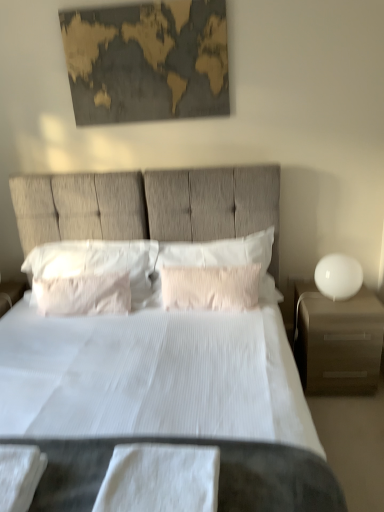
Image resolution: width=384 pixels, height=512 pixels. What do you see at coordinates (338, 276) in the screenshot?
I see `white glossy sphere at right` at bounding box center [338, 276].

Locate an element on the screen. This screenshot has height=512, width=384. white textured pillow at center, acting as the 2th pillow starting from the right is located at coordinates [210, 287].

Where is `white cotton towel at lower left, which is the first sheet from left to right`? This screenshot has height=512, width=384. white cotton towel at lower left, which is the first sheet from left to right is located at coordinates (19, 476).

I want to click on pink textured pillow at center, the 4th pillow viewed from the left, so [217, 252].

Image resolution: width=384 pixels, height=512 pixels. I want to click on white glossy sphere at right, so click(338, 276).

Based on their sizes in the image, would you say white cotton sheet at center, the 2th sheet positioned from the left, is bigger or smaller than matte brown nightstand at right?

white cotton sheet at center, the 2th sheet positioned from the left, is smaller than matte brown nightstand at right.

How different are the orientations of white cotton sheet at center, the 2th sheet positioned from the left, and matte brown nightstand at right in degrees?

white cotton sheet at center, the 2th sheet positioned from the left, and matte brown nightstand at right are facing 1.43 degrees away from each other.

Is white cotton sheet at center, the 2th sheet positioned from the left, positioned in front of matte brown nightstand at right?

Yes.

From a real-world perspective, which is physically above, white cotton sheet at center, the first sheet viewed from the right, or matte brown nightstand at right?

white cotton sheet at center, the first sheet viewed from the right, is physically above.

You are a GUI agent. You are given a task and a screenshot of the screen. Output one action in this format:
    pyautogui.click(x=<x>, y=<y>)
    Task: Click on the bed that appears on the left of white cotton sheet at center, the 2th sheet positioned from the left
    The image size is (384, 512).
    Given the screenshot: What is the action you would take?
    pyautogui.click(x=148, y=205)

Can you tell me how much white textured bed at center and white cotton sheet at center, the 2th sheet positioned from the left, differ in facing direction?

The angle between the facing direction of white textured bed at center and the facing direction of white cotton sheet at center, the 2th sheet positioned from the left, is 0.000209 degrees.

Considering the sizes of objects white textured bed at center and white cotton sheet at center, the 2th sheet positioned from the left, in the image provided, who is smaller, white textured bed at center or white cotton sheet at center, the 2th sheet positioned from the left,?

Smaller between the two is white cotton sheet at center, the 2th sheet positioned from the left.

Based on the photo, does white textured bed at center have a greater width compared to white cotton sheet at center, the first sheet viewed from the right?

Correct, the width of white textured bed at center exceeds that of white cotton sheet at center, the first sheet viewed from the right.

In the scene shown: Considering the relative sizes of white soft pillow at center, placed as the first pillow when sorted from left to right, and white soft pillow at center, marked as the 3th pillow in a right-to-left arrangement, in the image provided, is white soft pillow at center, placed as the first pillow when sorted from left to right, bigger than white soft pillow at center, marked as the 3th pillow in a right-to-left arrangement,?

Yes, white soft pillow at center, placed as the first pillow when sorted from left to right, is bigger than white soft pillow at center, marked as the 3th pillow in a right-to-left arrangement.

Is white soft pillow at center, marked as the 4th pillow in a right-to-left arrangement, placed right next to white soft pillow at center, which is the second pillow from left to right?

Yes, white soft pillow at center, marked as the 4th pillow in a right-to-left arrangement, is next to white soft pillow at center, which is the second pillow from left to right.

Consider the image. Which object is positioned more to the right, white soft pillow at center, marked as the 4th pillow in a right-to-left arrangement, or white soft pillow at center, marked as the 3th pillow in a right-to-left arrangement?

From the viewer's perspective, white soft pillow at center, marked as the 3th pillow in a right-to-left arrangement, appears more on the right side.

Considering the points (118, 285) and (70, 308), which point is in front, point (118, 285) or point (70, 308)?

Positioned in front is point (70, 308).

In the image, there is a white cotton sheet at center, the 2th sheet positioned from the left. Where is `sheet below it (from the image's perspective)`? The image size is (384, 512). sheet below it (from the image's perspective) is located at coordinates (19, 476).

Consider the image. From the image's perspective, is white cotton sheet at center, the 2th sheet positioned from the left, under white cotton towel at lower left, which is the first sheet from left to right?

Incorrect, from the image's perspective, white cotton sheet at center, the 2th sheet positioned from the left, is higher than white cotton towel at lower left, which is the first sheet from left to right.

Are white cotton sheet at center, the first sheet viewed from the right, and white cotton towel at lower left, which is the first sheet from left to right, making contact?

No, white cotton sheet at center, the first sheet viewed from the right, is not with white cotton towel at lower left, which is the first sheet from left to right.

Which object is further away from the camera taking this photo, white cotton sheet at center, the 2th sheet positioned from the left, or white cotton towel at lower left, which is the first sheet from left to right?

white cotton towel at lower left, which is the first sheet from left to right, is behind.

Is pink textured pillow at center, the 4th pillow viewed from the left, smaller than white glossy sphere at right?

Incorrect, pink textured pillow at center, the 4th pillow viewed from the left, is not smaller in size than white glossy sphere at right.

Who is taller, pink textured pillow at center, positioned as the 1th pillow in right-to-left order, or white glossy sphere at right?

pink textured pillow at center, positioned as the 1th pillow in right-to-left order.

From a real-world perspective, is pink textured pillow at center, positioned as the 1th pillow in right-to-left order, positioned over white glossy sphere at right based on gravity?

Yes, from a real-world perspective, pink textured pillow at center, positioned as the 1th pillow in right-to-left order, is on top of white glossy sphere at right.

How many degrees apart are the facing directions of pink textured pillow at center, positioned as the 1th pillow in right-to-left order, and white glossy sphere at right?

The angular difference between pink textured pillow at center, positioned as the 1th pillow in right-to-left order, and white glossy sphere at right is 0.187 degrees.

Is white glossy sphere at right located outside white cotton sheet at center, the 2th sheet positioned from the left?

Yes, white glossy sphere at right is not within white cotton sheet at center, the 2th sheet positioned from the left.

Does white glossy sphere at right turn towards white cotton sheet at center, the first sheet viewed from the right?

No, white glossy sphere at right is not facing towards white cotton sheet at center, the first sheet viewed from the right.

From the image's perspective, which one is positioned higher, white glossy sphere at right or white cotton sheet at center, the first sheet viewed from the right?

white glossy sphere at right appears higher in the image.

Where is `the 2nd pillow above when counting from the white textured bed at center (from the image's perspective)`? the 2nd pillow above when counting from the white textured bed at center (from the image's perspective) is located at coordinates (210, 287).

Is white textured pillow at center, acting as the 2th pillow starting from the right, far away from white textured bed at center?

No.

Between white textured pillow at center, acting as the 2th pillow starting from the right, and white textured bed at center, which one has larger size?

With larger size is white textured bed at center.

This screenshot has width=384, height=512. I want to click on the 1st sheet counting from the left side of the matte brown nightstand at right, so click(x=160, y=479).

From the white textured bed at center, count 1st sheets backward and point to it. Please provide its 2D coordinates.

[(160, 479)]

Looking at the image, which one is located further to white soft pillow at center, marked as the 4th pillow in a right-to-left arrangement, white textured bed at center or pink textured pillow at center, the 4th pillow viewed from the left?

Among the two, pink textured pillow at center, the 4th pillow viewed from the left, is located further to white soft pillow at center, marked as the 4th pillow in a right-to-left arrangement.

From the image, which object appears to be nearer to white cotton towel at lower left, which is the first sheet from left to right, white textured pillow at center, which is the third pillow in left-to-right order, or white soft pillow at center, marked as the 4th pillow in a right-to-left arrangement?

white soft pillow at center, marked as the 4th pillow in a right-to-left arrangement, lies closer to white cotton towel at lower left, which is the first sheet from left to right, than the other object.

Considering their positions, is white cotton sheet at center, the first sheet viewed from the right, positioned further to white glossy sphere at right than white cotton towel at lower left, the second sheet from the right?

white cotton towel at lower left, the second sheet from the right, lies further to white glossy sphere at right than the other object.

Looking at the image, which one is located closer to white soft pillow at center, marked as the 3th pillow in a right-to-left arrangement, matte brown nightstand at right or white soft pillow at center, marked as the 4th pillow in a right-to-left arrangement?

Among the two, white soft pillow at center, marked as the 4th pillow in a right-to-left arrangement, is located nearer to white soft pillow at center, marked as the 3th pillow in a right-to-left arrangement.

Looking at the image, which one is located closer to white textured bed at center, white soft pillow at center, placed as the first pillow when sorted from left to right, or white cotton towel at lower left, the second sheet from the right?

white soft pillow at center, placed as the first pillow when sorted from left to right, is positioned closer to the anchor white textured bed at center.

Considering their positions, is white textured pillow at center, acting as the 2th pillow starting from the right, positioned further to white cotton towel at lower left, the second sheet from the right, than white textured bed at center?

white textured bed at center.

From the image, which object appears to be farther from gold textured map at upper center, white textured bed at center or white textured pillow at center, acting as the 2th pillow starting from the right?

Based on the image, white textured pillow at center, acting as the 2th pillow starting from the right, appears to be further to gold textured map at upper center.

Looking at the image, which one is located closer to white textured bed at center, gold textured map at upper center or white soft pillow at center, placed as the first pillow when sorted from left to right?

white soft pillow at center, placed as the first pillow when sorted from left to right, lies closer to white textured bed at center than the other object.

Image resolution: width=384 pixels, height=512 pixels. I want to click on nightstand between white cotton sheet at center, the 2th sheet positioned from the left, and white textured pillow at center, acting as the 2th pillow starting from the right, along the z-axis, so click(x=337, y=341).

Where is `bedside lamp between gold textured map at upper center and white textured pillow at center, acting as the 2th pillow starting from the right, from top to bottom`? This screenshot has height=512, width=384. bedside lamp between gold textured map at upper center and white textured pillow at center, acting as the 2th pillow starting from the right, from top to bottom is located at coordinates (338, 276).

The height and width of the screenshot is (512, 384). In order to click on sheet between white cotton sheet at center, the first sheet viewed from the right, and pink textured pillow at center, positioned as the 1th pillow in right-to-left order, along the z-axis in this screenshot , I will do `click(19, 476)`.

Find the location of `sheet between gold textured map at upper center and white cotton towel at lower left, the second sheet from the right, in the vertical direction`. sheet between gold textured map at upper center and white cotton towel at lower left, the second sheet from the right, in the vertical direction is located at coordinates (160, 479).